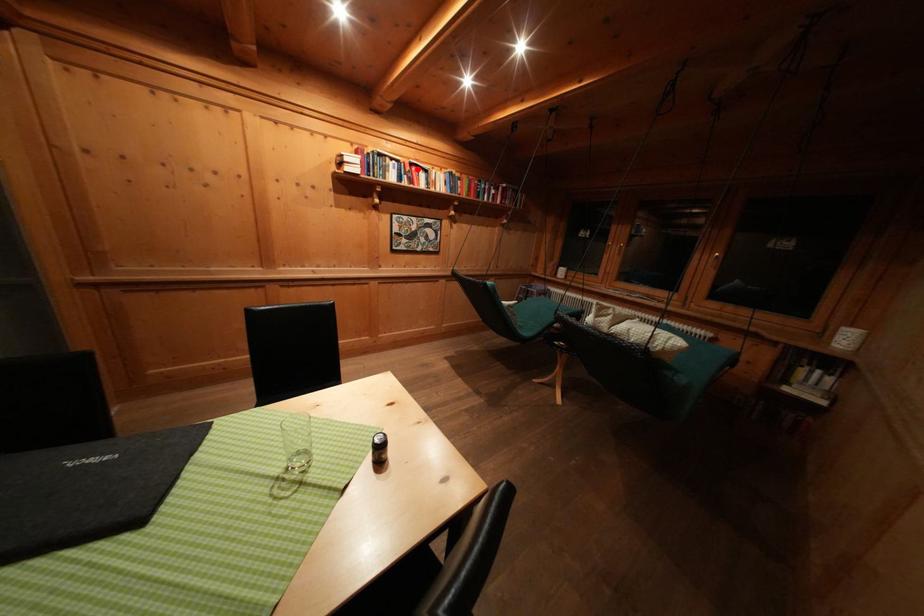
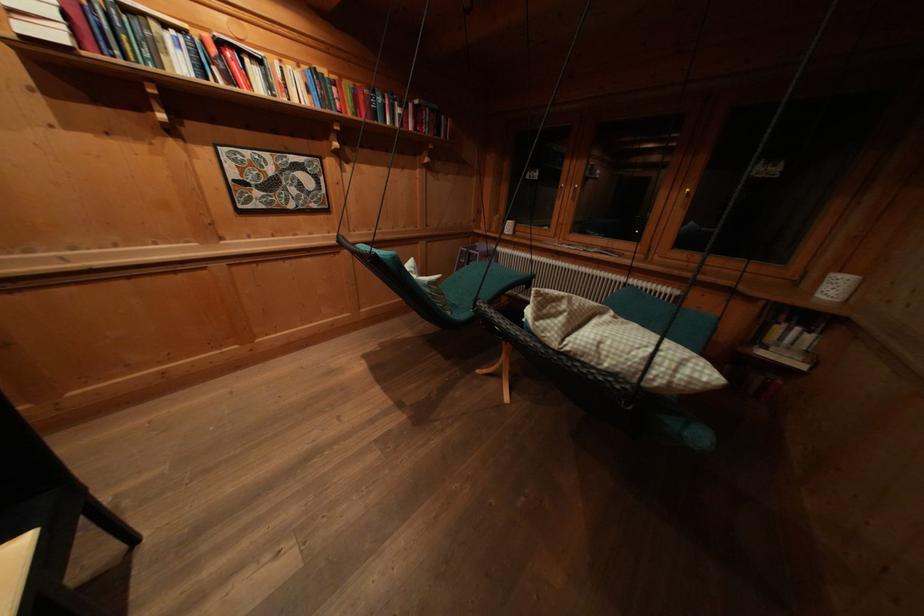
Where in the second image is the point corresponding to the highlighted location from the first image?

(225, 47)